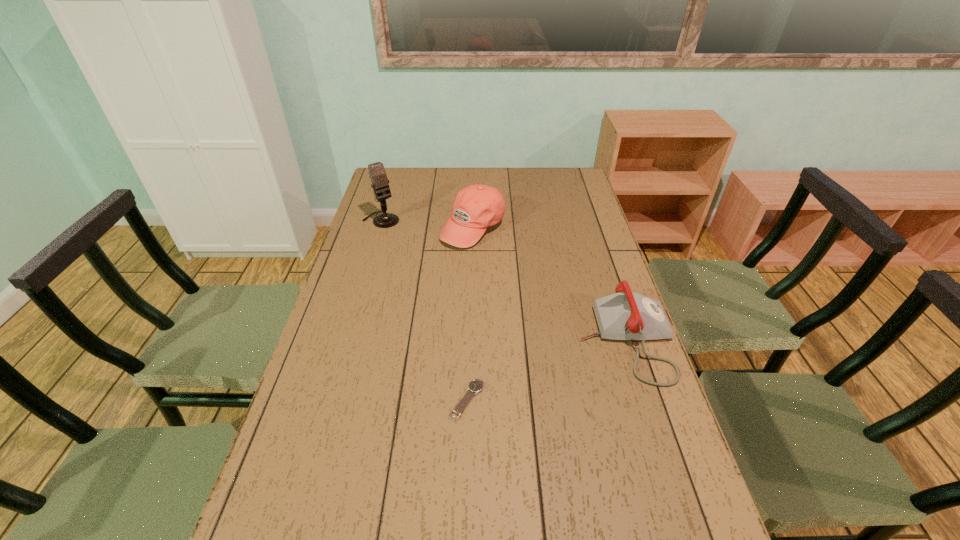
This screenshot has height=540, width=960. In order to click on empty space that is in between the tallest object and the shortest object in this screenshot , I will do `click(424, 310)`.

Identify the location of object that is the second closest to the shortest object. (476, 207).

At what (x,y) coordinates should I click in order to perform the action: click on object identified as the second closest to the leftmost object. Please return your answer as a coordinate pair (x, y). The height and width of the screenshot is (540, 960). Looking at the image, I should click on (624, 315).

Find the location of a particular element. Image resolution: width=960 pixels, height=540 pixels. blank area in the image that satisfies the following two spatial constraints: 1. on the front side of the telephone; 2. on the dial of the tallest object is located at coordinates (345, 341).

Identify the location of free spot that satisfies the following two spatial constraints: 1. on the front side of the second tallest object; 2. on the dial of the telephone. The height and width of the screenshot is (540, 960). (470, 341).

Identify the location of free spot that satisfies the following two spatial constraints: 1. on the back side of the watch; 2. on the dial of the telephone. (468, 341).

This screenshot has height=540, width=960. Find the location of `vacant space that satisfies the following two spatial constraints: 1. on the front side of the leftmost object; 2. on the right side of the third shortest object`. vacant space that satisfies the following two spatial constraints: 1. on the front side of the leftmost object; 2. on the right side of the third shortest object is located at coordinates click(x=378, y=228).

The width and height of the screenshot is (960, 540). I want to click on blank area in the image that satisfies the following two spatial constraints: 1. on the back side of the third shortest object; 2. on the left side of the shortest object, so click(471, 228).

I want to click on free point that satisfies the following two spatial constraints: 1. on the front side of the rightmost object; 2. on the dial of the microphone, so pyautogui.click(x=345, y=341).